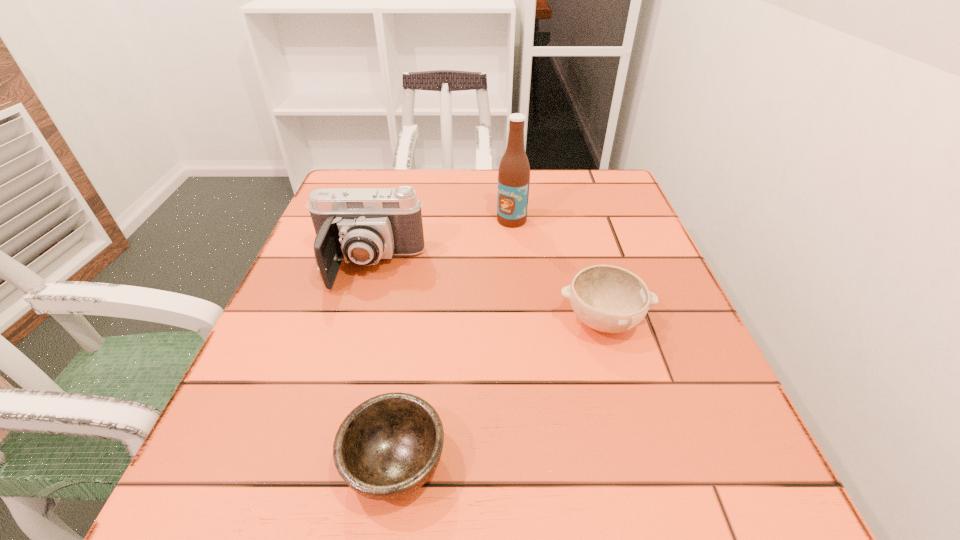
What are the coordinates of `beer bottle` in the screenshot? It's located at (514, 170).

Image resolution: width=960 pixels, height=540 pixels. Find the location of `the second object from right to left`. the second object from right to left is located at coordinates (514, 170).

Find the location of a particular element. the second farthest object is located at coordinates (360, 225).

Identify the location of camera. (360, 225).

You are a GUI agent. You are given a task and a screenshot of the screen. Output one action in this format:
    pyautogui.click(x=<x>, y=<y>)
    Task: Click on the taller bowl
    
    Given the screenshot: What is the action you would take?
    pyautogui.click(x=610, y=299)

Locate an element on the screen. The width and height of the screenshot is (960, 540). the third tallest object is located at coordinates (610, 299).

Identify the location of the nearest object. (386, 448).

This screenshot has height=540, width=960. What are the coordinates of `the nearer bowl` in the screenshot? It's located at (386, 448).

Locate an element on the screen. The height and width of the screenshot is (540, 960). free point located 0.370m on the left of the beer bottle is located at coordinates pyautogui.click(x=343, y=220).

I want to click on vacant space located at the front of the camera with an open lens cover, so click(336, 379).